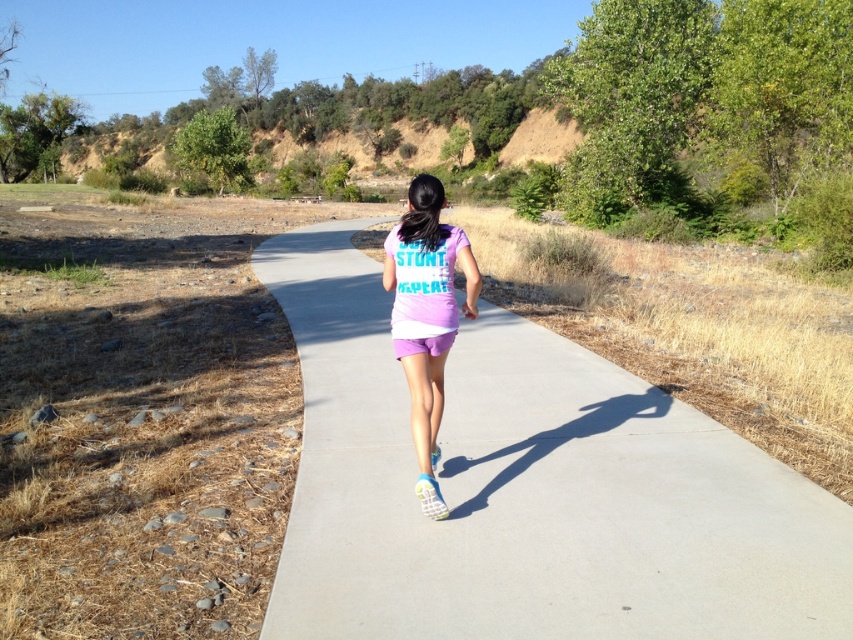
Which is in front, point (312, 401) or point (453, 332)?

Point (453, 332) is more forward.

Is point (267, 262) less distant than point (445, 353)?

No, (267, 262) is further to viewer.

Identify the location of smooth concrete pavement at center. The height and width of the screenshot is (640, 853). (527, 490).